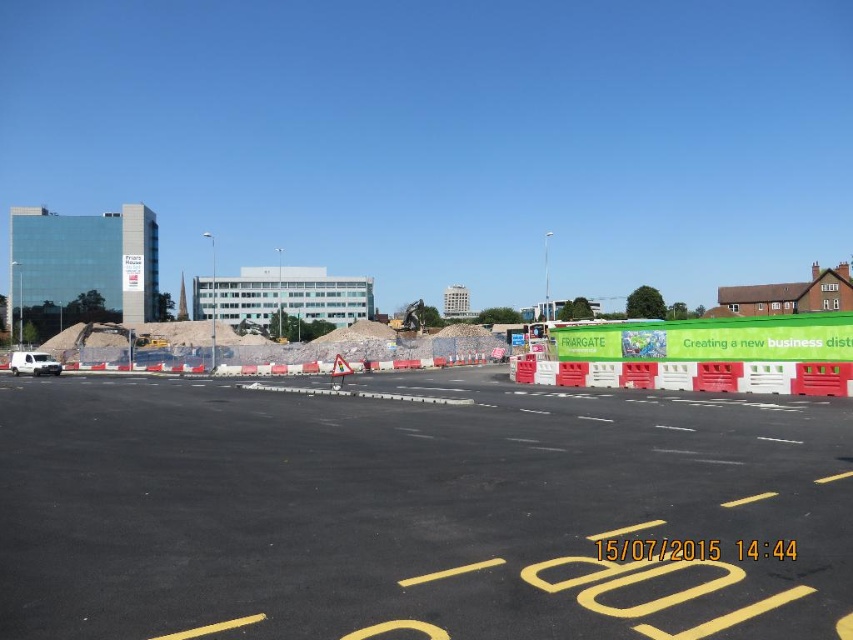
Question: Estimate the real-world distances between objects in this image. Which object is farther from the white matte van at lower left?

Choices:
 (A) white/red plastic barrier at center
 (B) black asphalt parking lot at center

Answer: (B)

Question: Among these objects, which one is nearest to the camera?

Choices:
 (A) black asphalt parking lot at center
 (B) white matte van at lower left

Answer: (A)

Question: Which of the following is the farthest from the observer?

Choices:
 (A) (15, 372)
 (B) (782, 372)

Answer: (A)

Question: Observing the image, what is the correct spatial positioning of black asphalt parking lot at center in reference to white matte van at lower left?

Choices:
 (A) above
 (B) below

Answer: (B)

Question: Is black asphalt parking lot at center above white matte van at lower left?

Choices:
 (A) yes
 (B) no

Answer: (B)

Question: From the image, what is the correct spatial relationship of black asphalt parking lot at center in relation to white matte van at lower left?

Choices:
 (A) below
 (B) above

Answer: (A)